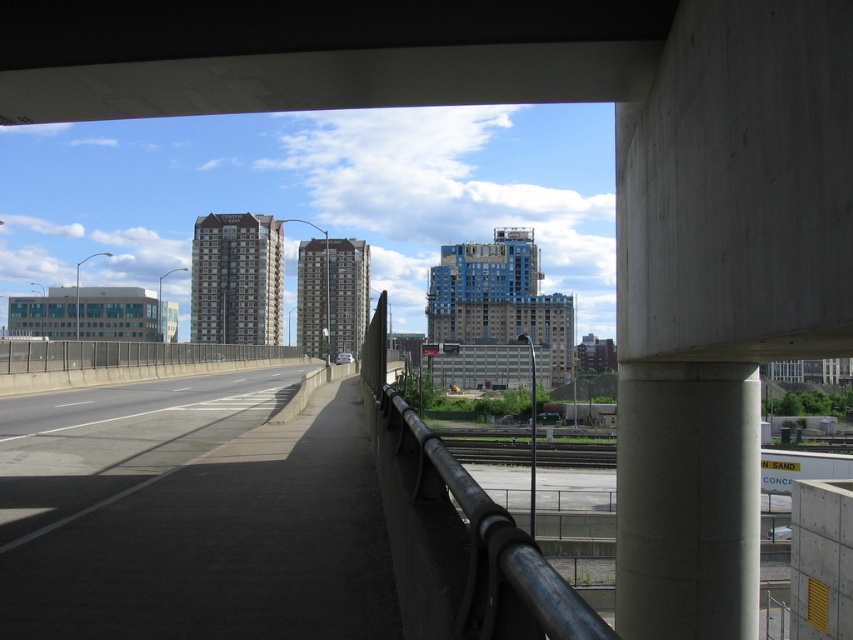
You are a delivery drone operator. Your drone has a wingspan of 1 meter. You need to fly the drone through the space between the concrete at upper center and the black metal fence at left. Can the drone pass through this gap?

The concrete at upper center is thinner than the black metal fence at left, so the gap between them is narrower than the width of the black metal fence at left. Since the drone has a wingspan of 1 meter, it might not fit if the gap is too narrow. However, without exact measurements, we cannot confirm for certain. Please check the actual gap width before attempting to fly through.

You are a construction worker standing at the edge of the paved walkway. You need to reach the concrete at upper center to perform maintenance. Can you safely walk directly to it from your current position?

The concrete at upper center is 8.43 meters away from the camera. Since you are at the edge of the paved walkway, which is separated by a metal railing from the road below, you cannot directly walk to it without crossing the road or using another path.